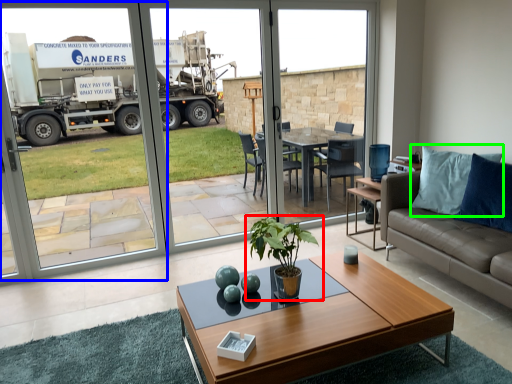
Question: Which is farther away from houseplant (highlighted by a red box)? screen door (highlighted by a blue box) or pillow (highlighted by a green box)?

Choices:
 (A) screen door
 (B) pillow

Answer: (A)